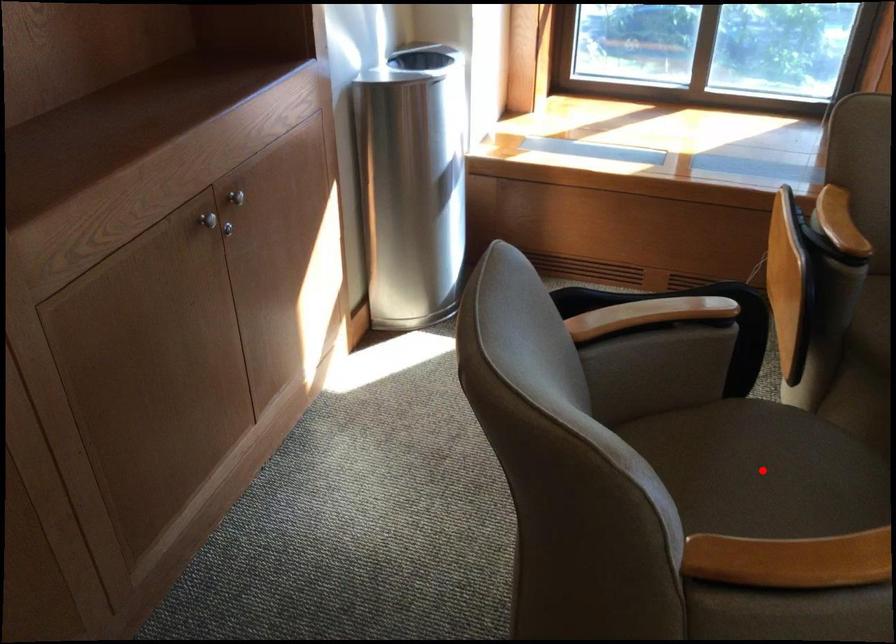
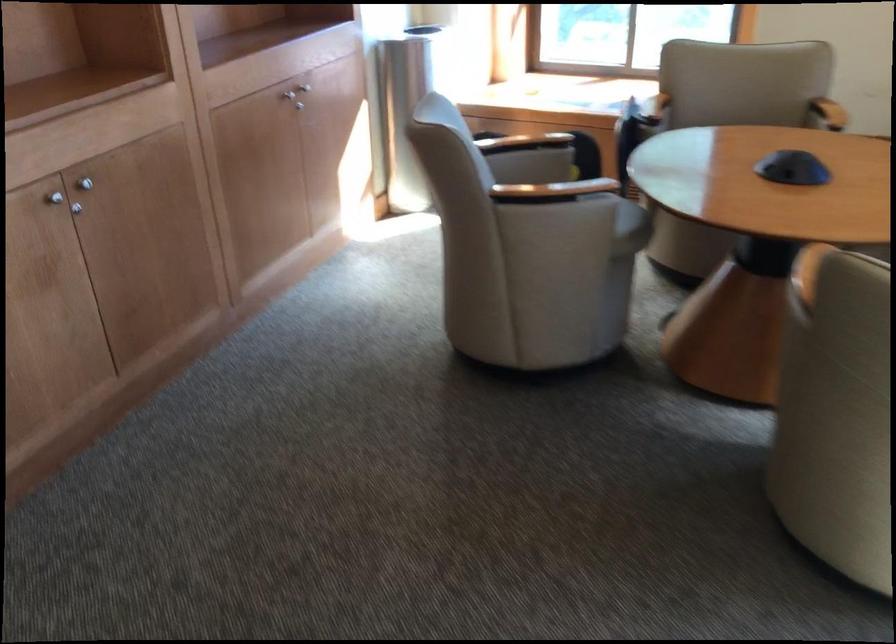
Question: I am providing you with two images of the same scene from different viewpoints. A red point is marked on the first image. At the location where the point appears in image 1, is it still visible in image 2?

Choices:
 (A) Yes
 (B) No

Answer: (B)